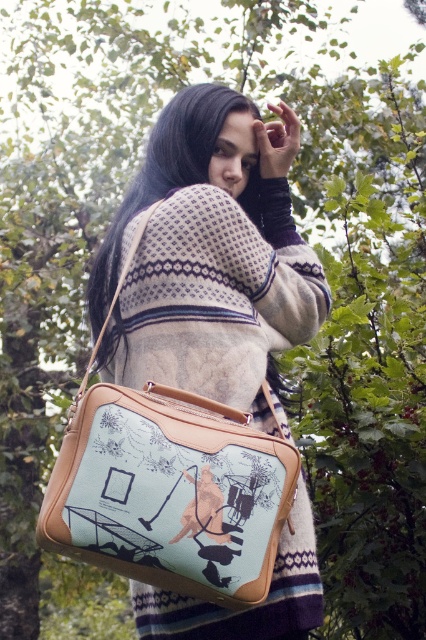
You are a delivery robot trying to locate the matte beige bag at lower left. According to the coordinates provided, where should you move to find it?

The matte beige bag at lower left is located at point (x=210, y=257).

You are organizing a backpacking trip and need to choose between the matte beige bag at lower left and the light blue fabric bag at center. Based on their sizes, which bag should you pick for carrying more camping gear?

The matte beige bag at lower left is bigger than the light blue fabric bag at center, so you should pick the matte beige bag at lower left for carrying more camping gear.

You are organizing a backpacking trip and need to choose between the matte beige bag at lower left and the light blue fabric bag at center based on their sizes. Which bag should you pick if you need the taller one?

The matte beige bag at lower left has a greater height compared to the light blue fabric bag at center, so you should pick the matte beige bag at lower left.